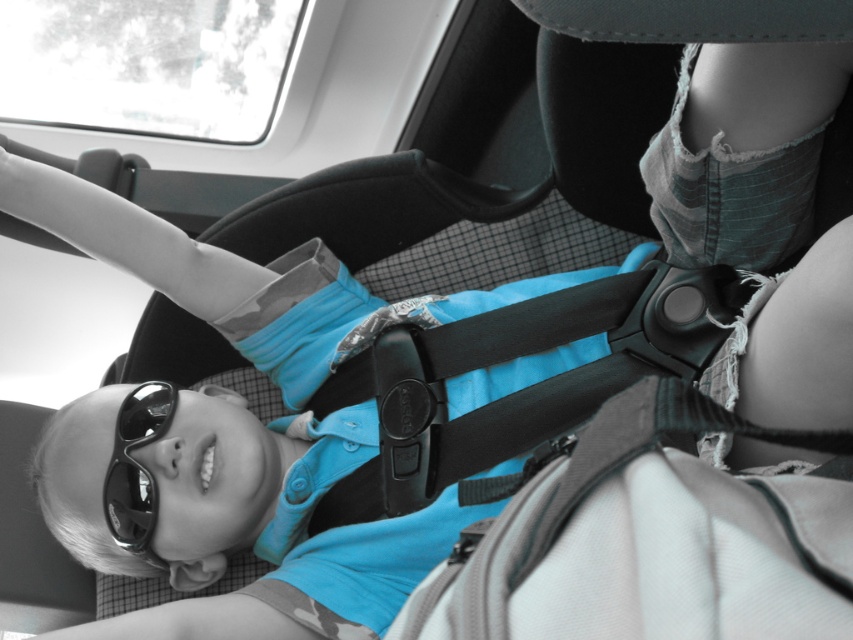
Measure the distance between black fabric seatbelt at center and camera.

black fabric seatbelt at center and camera are 37.90 inches apart from each other.

Between point (614, 358) and point (149, 481), which one is positioned behind?

The point (149, 481) is more distant.

Describe the element at coordinates (519, 388) in the screenshot. I see `black fabric seatbelt at center` at that location.

Where is `black fabric seatbelt at center`? The image size is (853, 640). black fabric seatbelt at center is located at coordinates coord(519,388).